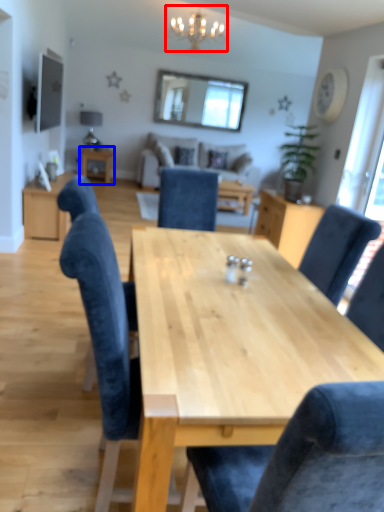
Question: Among these objects, which one is farthest to the camera, light fixture (highlighted by a red box) or table (highlighted by a blue box)?

Choices:
 (A) light fixture
 (B) table

Answer: (B)